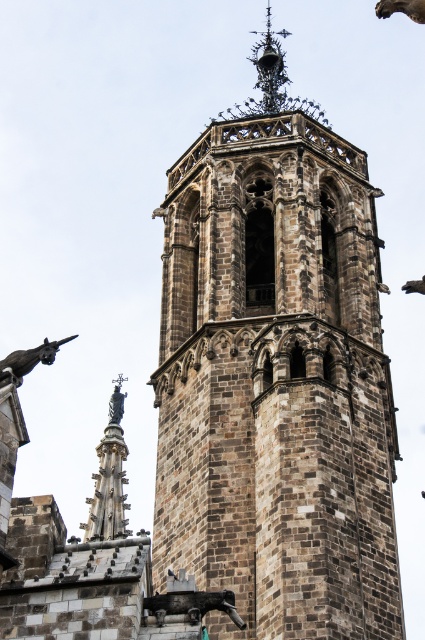
In the scene shown: Which is more to the left, black wrought iron spire at upper center or dark gray stone gargoyle at lower left?

From the viewer's perspective, dark gray stone gargoyle at lower left appears more on the left side.

Who is shorter, black wrought iron spire at upper center or dark gray stone gargoyle at lower left?

Standing shorter between the two is dark gray stone gargoyle at lower left.

Who is more distant from viewer, (265, 51) or (53, 358)?

The point (265, 51) is behind.

At what (x,y) coordinates should I click in order to perform the action: click on black wrought iron spire at upper center. Please return your answer as a coordinate pair (x, y). The height and width of the screenshot is (640, 425). Looking at the image, I should click on (269, 67).

Is brown stone tower at center further to camera compared to black wrought iron spire at upper center?

That is False.

What do you see at coordinates (277, 381) in the screenshot? This screenshot has width=425, height=640. I see `brown stone tower at center` at bounding box center [277, 381].

Is point (164, 337) closer to camera compared to point (255, 52)?

Yes, point (164, 337) is closer to viewer.

Locate an element on the screen. The width and height of the screenshot is (425, 640). brown stone tower at center is located at coordinates (277, 381).

Who is positioned more to the right, brown stone tower at center or dark gray stone gargoyle at lower left?

Positioned to the right is brown stone tower at center.

Is the position of brown stone tower at center less distant than that of dark gray stone gargoyle at lower left?

No, it is not.

Find the location of a particular element. Image resolution: width=425 pixels, height=640 pixels. brown stone tower at center is located at coordinates (277, 381).